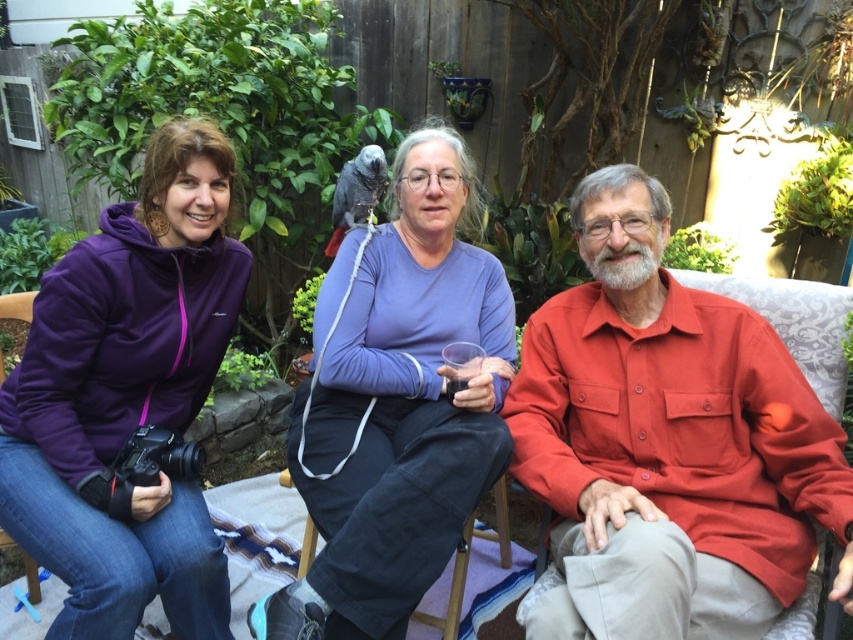
Between point (144, 600) and point (306, 620), which one is positioned behind?

Positioned behind is point (144, 600).

Find the location of a particular element. purple fleece jacket at left is located at coordinates (126, 397).

From the picture: Does purple cotton shirt at center appear over gray matte parrot at center?

Incorrect, purple cotton shirt at center is not positioned above gray matte parrot at center.

The width and height of the screenshot is (853, 640). I want to click on purple cotton shirt at center, so click(x=396, y=404).

I want to click on purple cotton shirt at center, so click(396, 404).

Which is more to the right, purple cotton shirt at center or denim at left?

purple cotton shirt at center is more to the right.

Does purple cotton shirt at center have a larger size compared to denim at left?

Yes.

You are a GUI agent. You are given a task and a screenshot of the screen. Output one action in this format:
    pyautogui.click(x=<x>, y=<y>)
    Task: Click on the purple cotton shirt at center
    The image size is (853, 640).
    Given the screenshot: What is the action you would take?
    pyautogui.click(x=396, y=404)